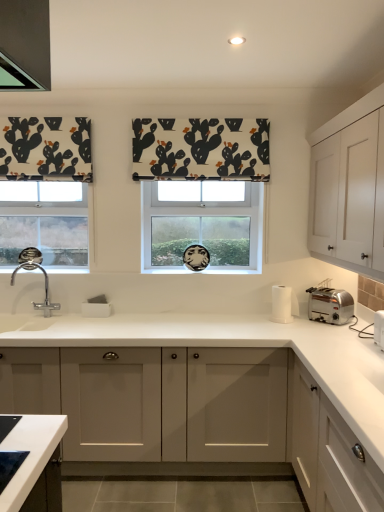
Question: Is white fabric with cactus print at center smaller than clear glass window at center?

Choices:
 (A) no
 (B) yes

Answer: (B)

Question: Considering the relative positions of white fabric with cactus print at center and clear glass window at center in the image provided, is white fabric with cactus print at center in front of clear glass window at center?

Choices:
 (A) yes
 (B) no

Answer: (A)

Question: From a real-world perspective, is white fabric with cactus print at center physically below clear glass window at center?

Choices:
 (A) no
 (B) yes

Answer: (A)

Question: From the image's perspective, does white fabric with cactus print at center appear lower than clear glass window at center?

Choices:
 (A) yes
 (B) no

Answer: (B)

Question: From the image's perspective, is white fabric with cactus print at center above clear glass window at center?

Choices:
 (A) no
 (B) yes

Answer: (B)

Question: Is white fabric with cactus print at center beside clear glass window at center?

Choices:
 (A) no
 (B) yes

Answer: (A)

Question: Considering the relative sizes of clear glass window at center and chrome metallic sink at left in the image provided, is clear glass window at center taller than chrome metallic sink at left?

Choices:
 (A) yes
 (B) no

Answer: (A)

Question: From a real-world perspective, is clear glass window at center located higher than chrome metallic sink at left?

Choices:
 (A) yes
 (B) no

Answer: (A)

Question: Is clear glass window at center outside chrome metallic sink at left?

Choices:
 (A) no
 (B) yes

Answer: (B)

Question: From the image's perspective, is clear glass window at center beneath chrome metallic sink at left?

Choices:
 (A) no
 (B) yes

Answer: (A)

Question: Does clear glass window at center lie behind chrome metallic sink at left?

Choices:
 (A) no
 (B) yes

Answer: (B)

Question: Is clear glass window at center aimed at chrome metallic sink at left?

Choices:
 (A) no
 (B) yes

Answer: (A)

Question: Is white paper towel holder at right, positioned as the 1th appliance in back-to-front order, shorter than white fabric with cactus print at center?

Choices:
 (A) yes
 (B) no

Answer: (A)